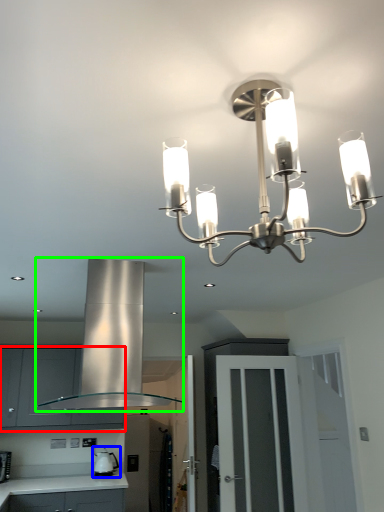
Question: Based on their relative distances, which object is nearer to cabinetry (highlighted by a red box)? Choose from appliance (highlighted by a blue box) and exhaust hood (highlighted by a green box).

Choices:
 (A) appliance
 (B) exhaust hood

Answer: (A)